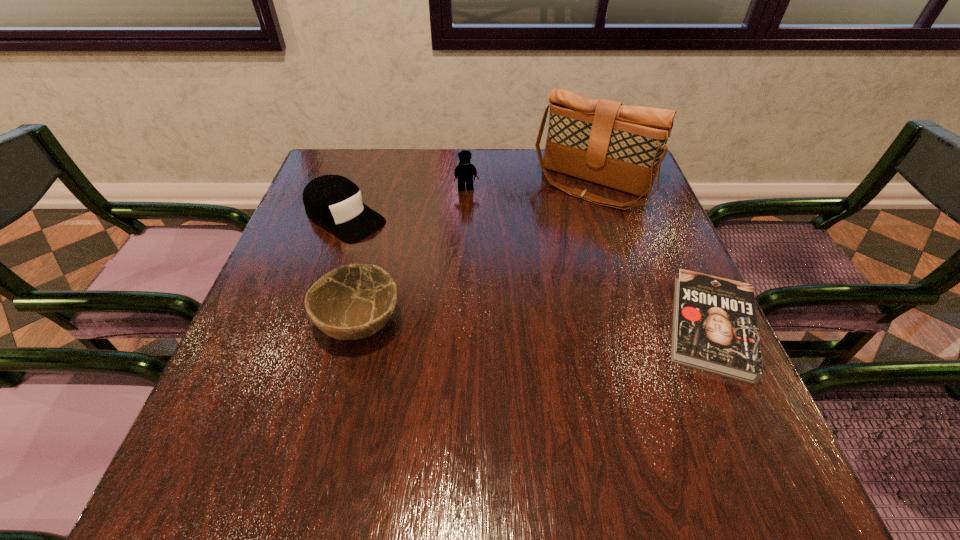
Find the location of `bowl`. bowl is located at coordinates (352, 302).

What are the coordinates of `the shortest object` in the screenshot? It's located at (715, 329).

Locate an element on the screen. This screenshot has height=540, width=960. Lego is located at coordinates (464, 172).

Image resolution: width=960 pixels, height=540 pixels. What are the coordinates of `the fourth shortest object` in the screenshot? It's located at (464, 172).

Locate an element on the screen. shoulder bag is located at coordinates (601, 141).

Find the location of a particular element. The width and height of the screenshot is (960, 540). cap is located at coordinates (334, 202).

This screenshot has width=960, height=540. Identify the location of vacant space located 0.050m on the left of the bowl. (293, 323).

Where is `blank area located 0.380m on the back of the shortest object`? The width and height of the screenshot is (960, 540). blank area located 0.380m on the back of the shortest object is located at coordinates (644, 180).

Locate an element on the screen. free space located on the front-facing side of the fourth shortest object is located at coordinates (472, 211).

Where is `vacant space located on the front-facing side of the fourth shortest object`? The image size is (960, 540). vacant space located on the front-facing side of the fourth shortest object is located at coordinates (480, 244).